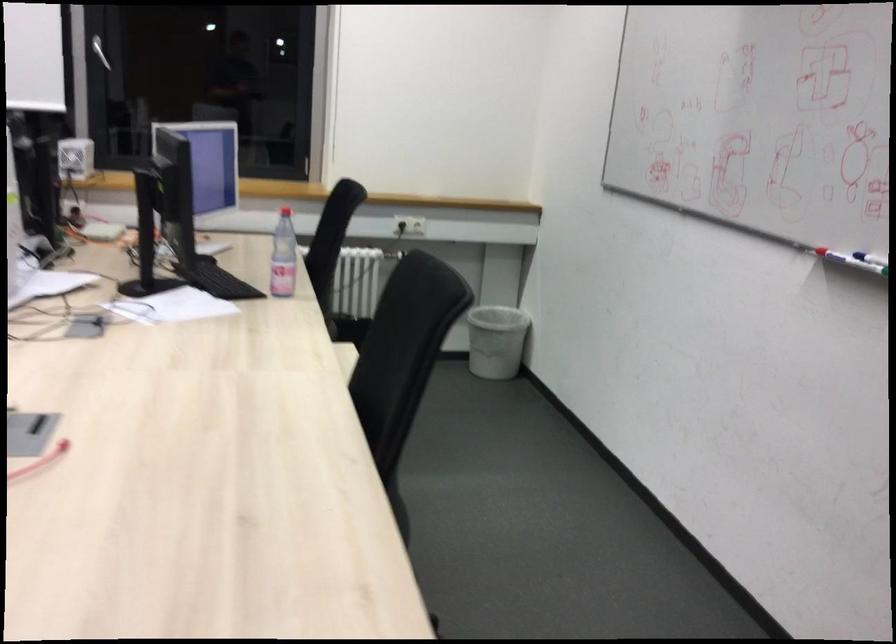
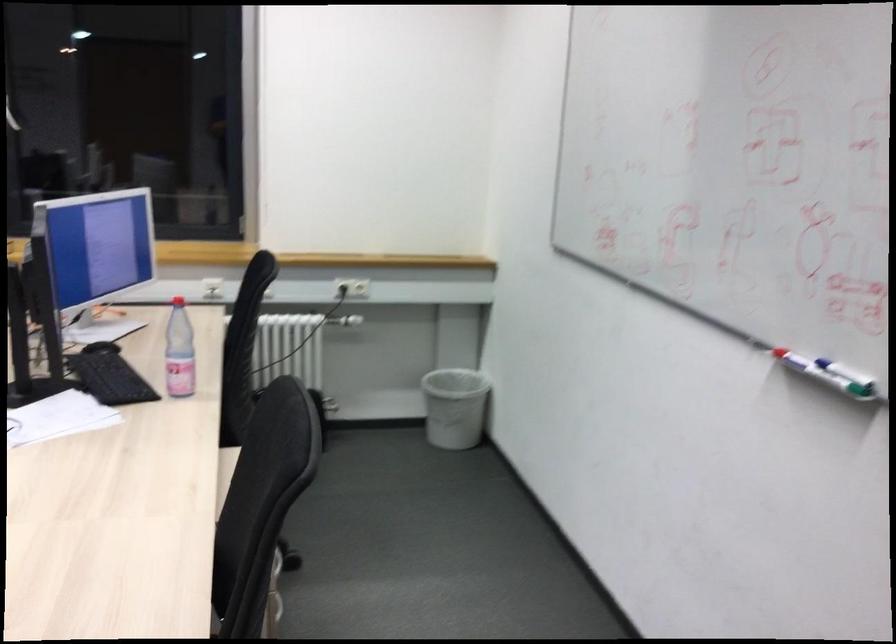
The point at (500,339) is marked in the first image. Where is the corresponding point in the second image?

(454, 406)